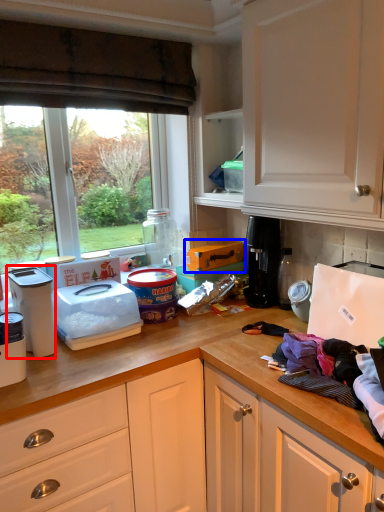
Question: Which object is closer to the camera taking this photo, kitchen appliance (highlighted by a red box) or cardboard box (highlighted by a blue box)?

Choices:
 (A) kitchen appliance
 (B) cardboard box

Answer: (A)